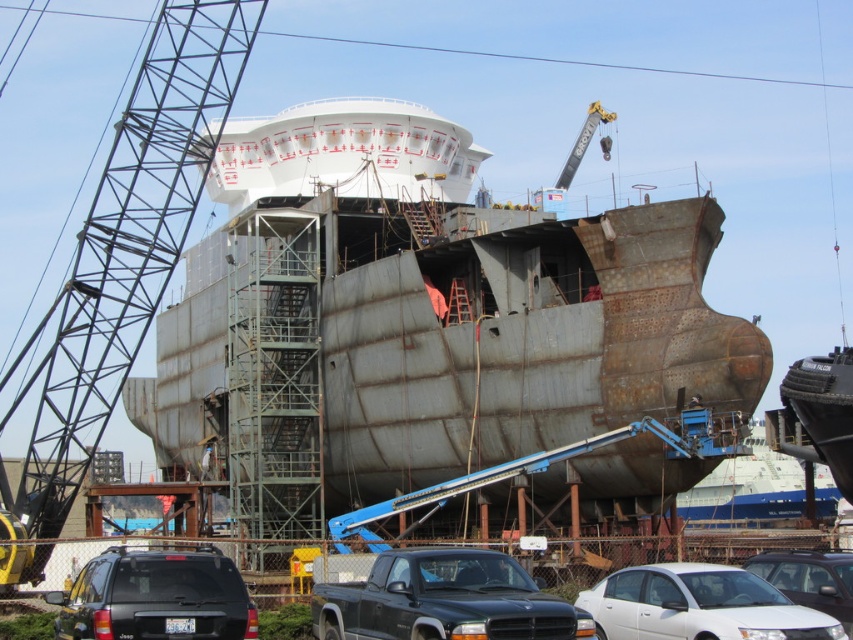
Can you confirm if rusty metal ship at center is shorter than rusty metal crane at left?

Yes.

Does rusty metal ship at center appear on the right side of rusty metal crane at left?

Correct, you'll find rusty metal ship at center to the right of rusty metal crane at left.

Is point (415, 230) farther from viewer compared to point (44, 563)?

Yes, point (415, 230) is behind point (44, 563).

This screenshot has width=853, height=640. In order to click on rusty metal ship at center in this screenshot , I will do `click(438, 310)`.

Measure the distance from rusty metal ship at center to rusty metal ship at lower right.

rusty metal ship at center is 133.69 feet from rusty metal ship at lower right.

Does rusty metal ship at center have a lesser height compared to rusty metal ship at lower right?

In fact, rusty metal ship at center may be taller than rusty metal ship at lower right.

Find the location of `rusty metal ship at center`. rusty metal ship at center is located at coordinates (438, 310).

The width and height of the screenshot is (853, 640). Find the location of `rusty metal ship at center`. rusty metal ship at center is located at coordinates (438, 310).

Which is in front, point (598, 589) or point (793, 598)?

Point (793, 598)

Is white matte sedan at lower right below white matte sedan at lower center?

Yes, white matte sedan at lower right is below white matte sedan at lower center.

Between point (833, 628) and point (848, 556), which one is positioned behind?

The point (848, 556) is more distant.

Locate an element on the screen. This screenshot has width=853, height=640. white matte sedan at lower right is located at coordinates (698, 605).